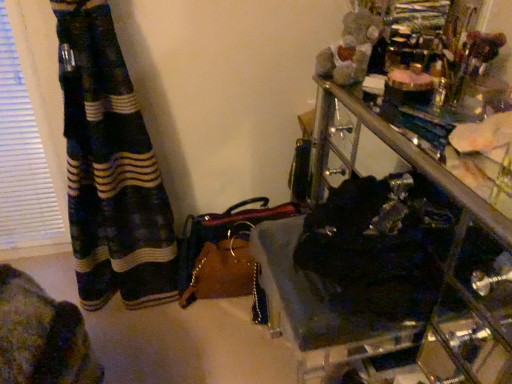
Question: Is black fabric at center taller or shorter than leather handbag at lower center?

Choices:
 (A) short
 (B) tall

Answer: (A)

Question: From the image's perspective, is black fabric at center above or below leather handbag at lower center?

Choices:
 (A) above
 (B) below

Answer: (A)

Question: Does point (482, 259) appear closer or farther from the camera than point (233, 289)?

Choices:
 (A) farther
 (B) closer

Answer: (B)

Question: From their relative heights in the image, would you say leather handbag at lower center is taller or shorter than black fabric at center?

Choices:
 (A) short
 (B) tall

Answer: (B)

Question: Is leather handbag at lower center inside or outside of black fabric at center?

Choices:
 (A) inside
 (B) outside

Answer: (B)

Question: Based on their sizes in the image, would you say leather handbag at lower center is bigger or smaller than black fabric at center?

Choices:
 (A) big
 (B) small

Answer: (A)

Question: From the image's perspective, is leather handbag at lower center above or below black fabric at center?

Choices:
 (A) below
 (B) above

Answer: (A)